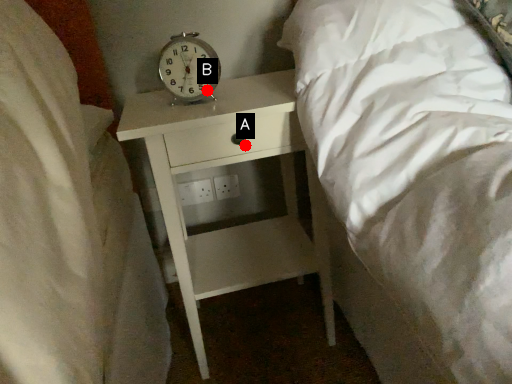
Question: Two points are circled on the image, labeled by A and B beside each circle. Which point appears farthest from the camera in this image?

Choices:
 (A) A is further
 (B) B is further

Answer: (B)